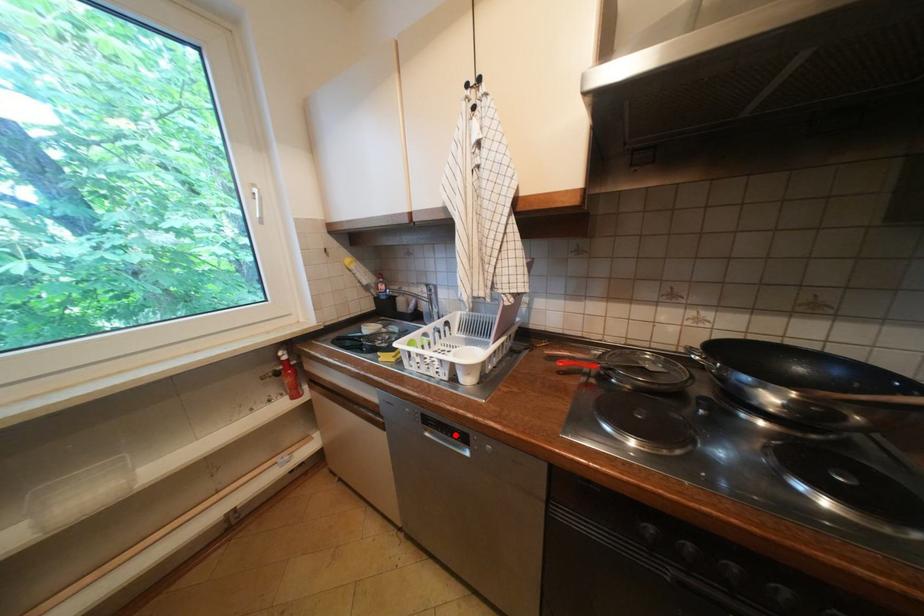
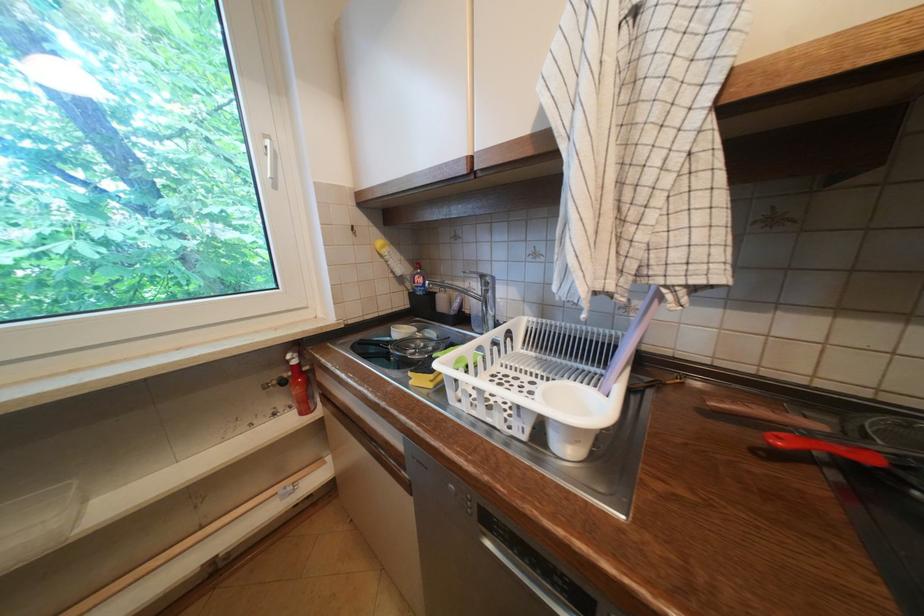
Question: I am providing you with two images of the same scene from different viewpoints. In image1, a red point is highlighted. Considering the same 3D point in image2, which of the following is correct?

Choices:
 (A) It is closer
 (B) It is farther

Answer: (A)